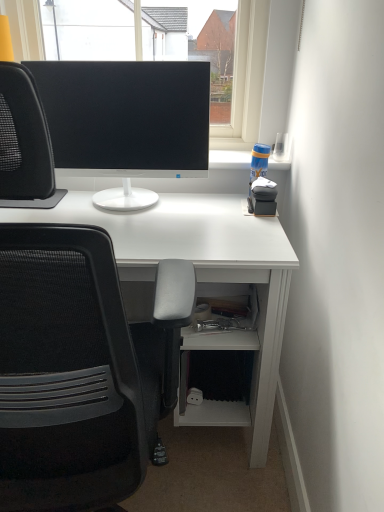
At what (x,y) coordinates should I click in order to perform the action: click on vacant space in front of matte black monitor at center. Please return your answer as a coordinate pair (x, y). Looking at the image, I should click on (144, 226).